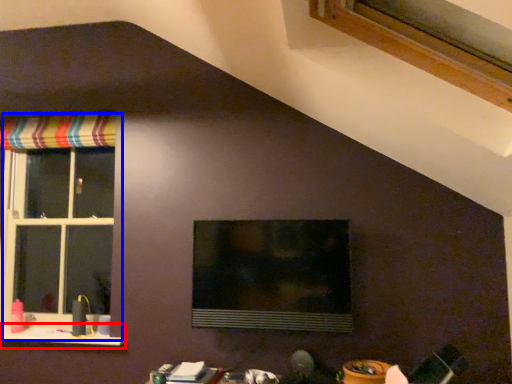
Question: Among these objects, which one is nearest to the camera, window sill (highlighted by a red box) or window (highlighted by a blue box)?

Choices:
 (A) window sill
 (B) window

Answer: (A)